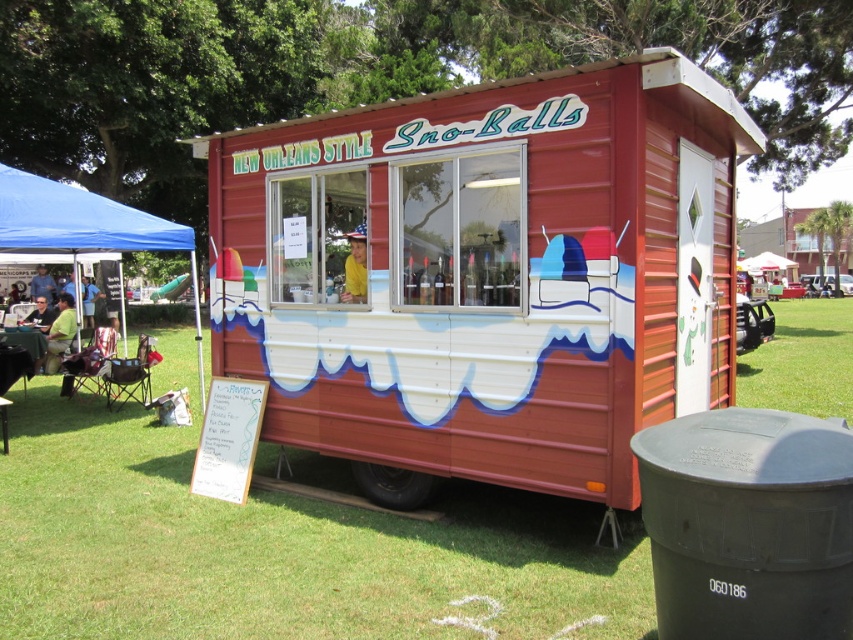
Is point (577, 616) farther from camera compared to point (91, 308)?

No, it is not.

Who is lower down, green grass at lower center or blue fabric chair at left?

green grass at lower center is lower down.

Find the location of a particular element. green grass at lower center is located at coordinates (280, 548).

Locate an element on the screen. This screenshot has height=640, width=853. green grass at lower center is located at coordinates (280, 548).

Describe the element at coordinates (76, 218) in the screenshot. The width and height of the screenshot is (853, 640). I see `blue fabric canopy at left` at that location.

This screenshot has height=640, width=853. Identify the location of blue fabric canopy at left. (76, 218).

Can you confirm if green matte shirt at lower left is positioned to the left of brushed metal water at bottle left?

Incorrect, green matte shirt at lower left is not on the left side of brushed metal water at bottle left.

The width and height of the screenshot is (853, 640). In order to click on green matte shirt at lower left in this screenshot , I will do `click(61, 333)`.

Between point (61, 349) and point (53, 292), which one is positioned behind?

The point (53, 292) is more distant.

Find the location of a particular element. green matte shirt at lower left is located at coordinates (61, 333).